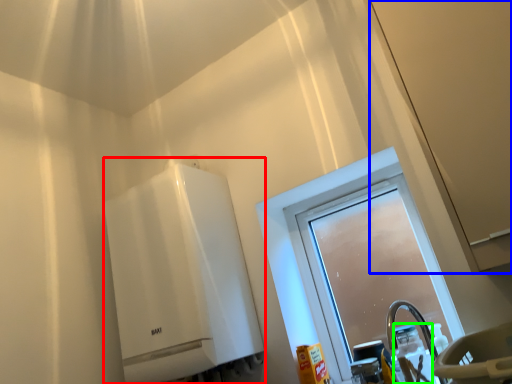
Question: Estimate the real-world distances between objects in this image. Which object is farther from water heater (highlighted by a red box), screen door (highlighted by a blue box) or bottle (highlighted by a green box)?

Choices:
 (A) screen door
 (B) bottle

Answer: (A)